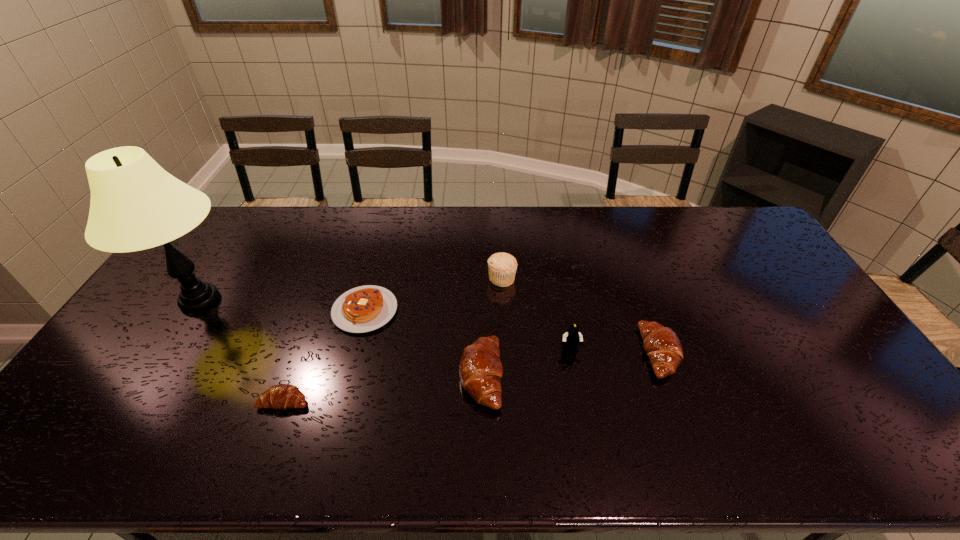
Image resolution: width=960 pixels, height=540 pixels. In the image, there is a desktop. Find the location of `free space at the right edge`. free space at the right edge is located at coordinates (807, 318).

Locate an element on the screen. The width and height of the screenshot is (960, 540). vacant space at the near left corner of the desktop is located at coordinates (81, 410).

The width and height of the screenshot is (960, 540). What are the coordinates of `free spot between the Lego and the second crescent roll from left to right` in the screenshot? It's located at (525, 363).

I want to click on vacant space that is in between the leftmost crescent roll and the second crescent roll from left to right, so click(x=383, y=388).

Identify the location of vacant space that's between the second tallest crescent roll and the muffin. (581, 315).

Locate an element on the screen. blank region between the pancake and the leftmost crescent roll is located at coordinates (324, 355).

I want to click on vacant space in between the third shortest object and the muffin, so click(x=581, y=315).

Where is `free space between the second shortest crescent roll and the pancake`? free space between the second shortest crescent roll and the pancake is located at coordinates (513, 332).

At what (x,y) coordinates should I click in order to perform the action: click on free spot between the pancake and the leftmost object. Please return your answer as a coordinate pair (x, y). Looking at the image, I should click on (282, 305).

You are a GUI agent. You are given a task and a screenshot of the screen. Output one action in this format:
    pyautogui.click(x=<x>, y=<y>)
    Task: Click on the free space between the sixth object from left to right and the pancake
    
    Given the screenshot: What is the action you would take?
    pyautogui.click(x=468, y=330)